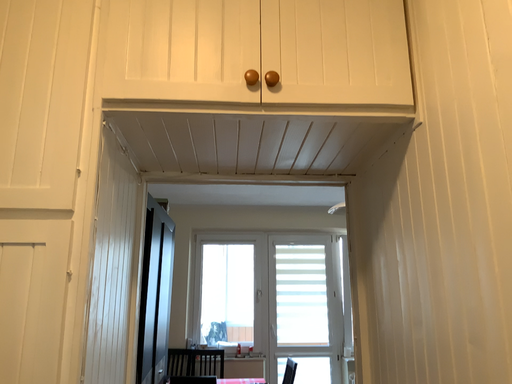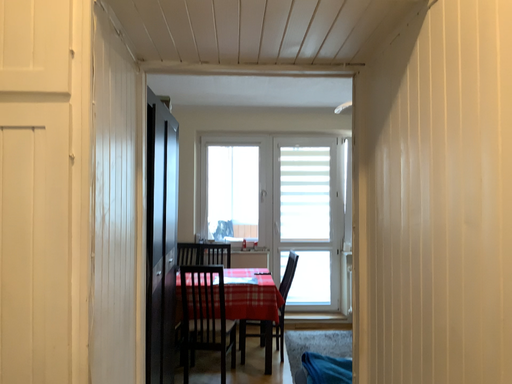
Question: How did the camera likely rotate when shooting the video?

Choices:
 (A) rotated upward
 (B) rotated downward

Answer: (B)